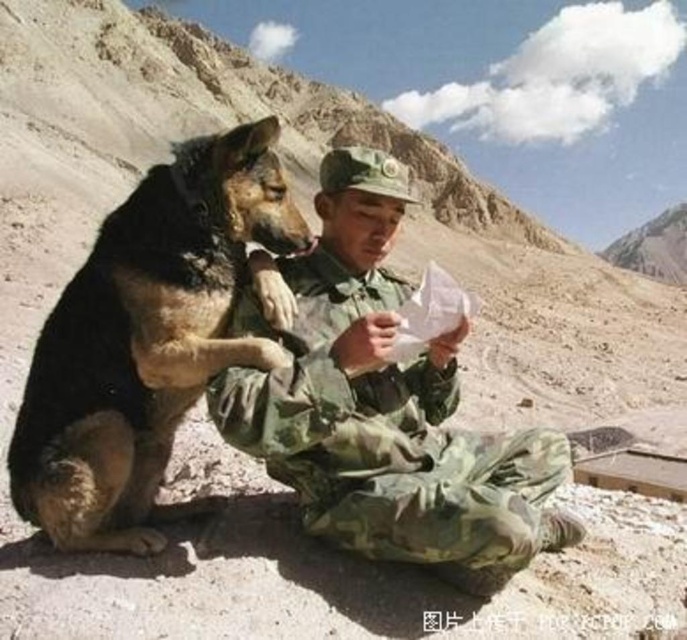
Question: Observing the image, what is the correct spatial positioning of camouflage uniform at center in reference to black fur dog at left?

Choices:
 (A) above
 (B) below

Answer: (B)

Question: Which of the following is the closest to the observer?

Choices:
 (A) (159, 548)
 (B) (510, 477)

Answer: (A)

Question: Is camouflage uniform at center smaller than black fur dog at left?

Choices:
 (A) no
 (B) yes

Answer: (B)

Question: Where is camouflage uniform at center located in relation to black fur dog at left in the image?

Choices:
 (A) right
 (B) left

Answer: (A)